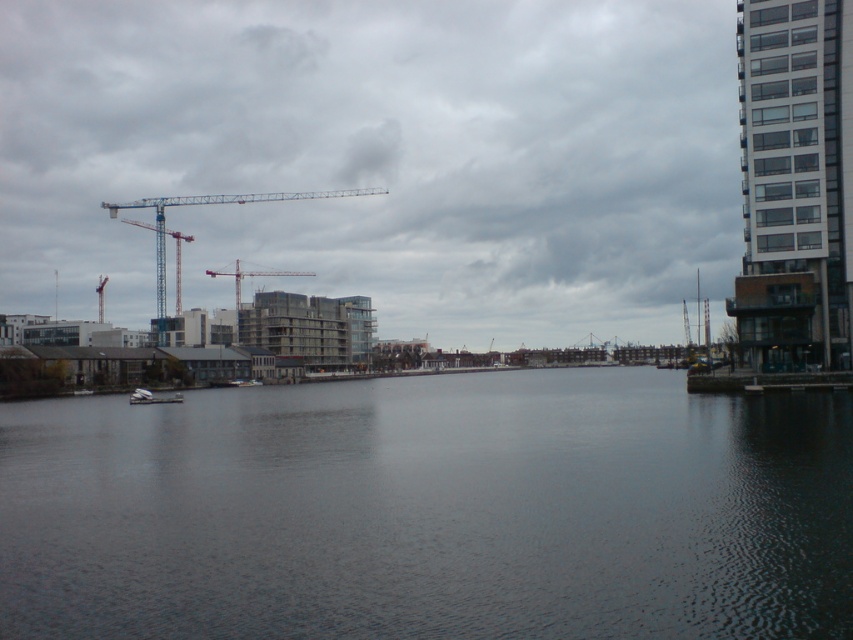
Is point (485, 580) farther from viewer compared to point (173, 397)?

No, it is in front of (173, 397).

In the scene shown: Who is lower down, dark gray water at center or white matte boat at center?

white matte boat at center

Is point (277, 609) behind point (177, 403)?

No, it is in front of (177, 403).

The image size is (853, 640). What are the coordinates of `dark gray water at center` in the screenshot? It's located at (430, 509).

In the scene shown: Which is above, dark gray water at center or metallic blue crane at center-left?

metallic blue crane at center-left

Does dark gray water at center have a greater width compared to metallic blue crane at center-left?

In fact, dark gray water at center might be narrower than metallic blue crane at center-left.

Find the location of a particular element. dark gray water at center is located at coordinates (430, 509).

Does metallic blue crane at center-left have a lesser height compared to white matte boat at center?

In fact, metallic blue crane at center-left may be taller than white matte boat at center.

Does metallic blue crane at center-left have a greater width compared to white matte boat at center?

Yes.

Where is `metallic blue crane at center-left`? The height and width of the screenshot is (640, 853). metallic blue crane at center-left is located at coordinates (213, 204).

Identify the location of metallic blue crane at center-left. (213, 204).